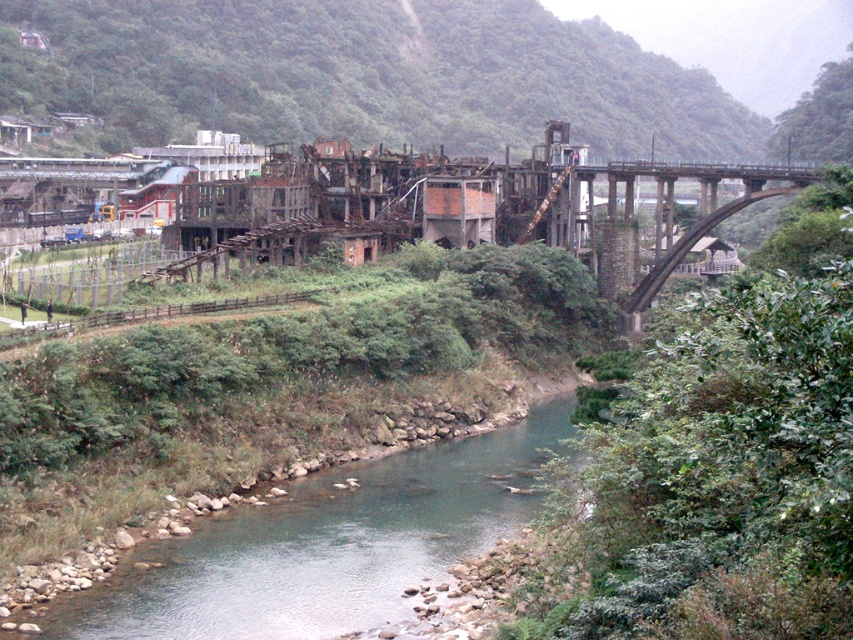
You are a photographer standing at the edge of the river. You want to capture a photo that includes both the clear water at center and the concrete arch bridge at right. Which object will appear larger in the photo?

The clear water at center will appear larger in the photo because it is closer to the viewer than the concrete arch bridge at right.

You are standing at the edge of the river and want to locate the clear water at center. According to the coordinates provided, in which direction should you look relative to your position?

The clear water at center is located at coordinates point [329,544]. Since the coordinate system is normalized, the x value of 0.850 indicates a position to the right, and the y value of 0.387 indicates a position slightly below the center. Therefore, you should look towards the right and slightly downward from your current position to locate the clear water at center.